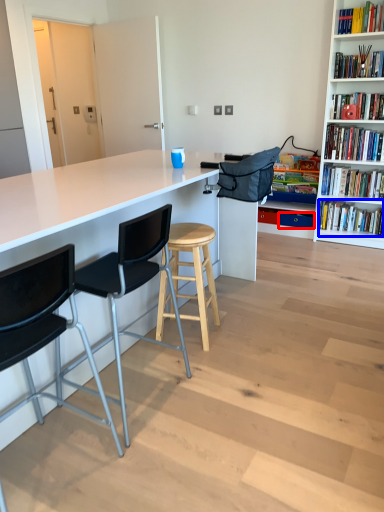
Question: Among these objects, which one is nearest to the camera, drawer (highlighted by a red box) or book (highlighted by a blue box)?

Choices:
 (A) drawer
 (B) book

Answer: (B)